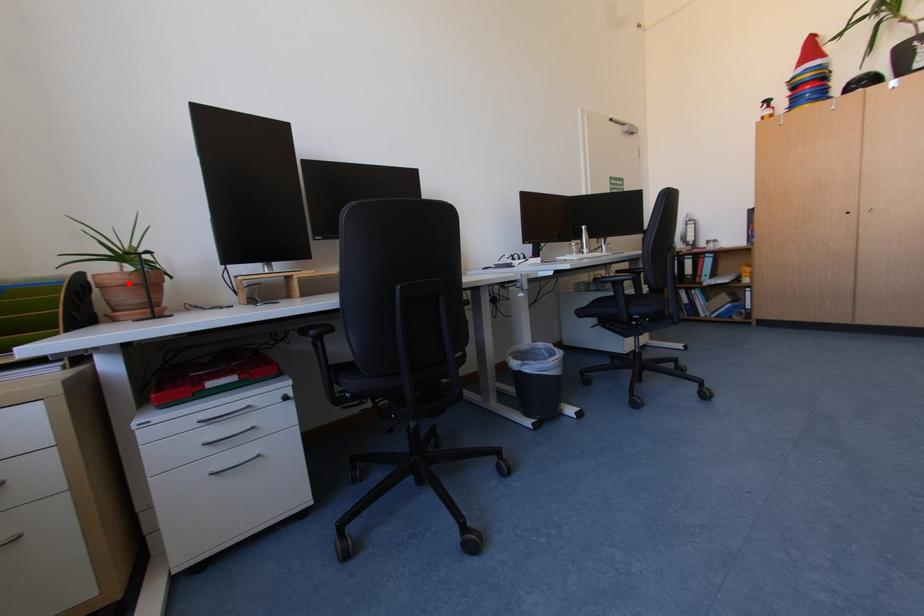
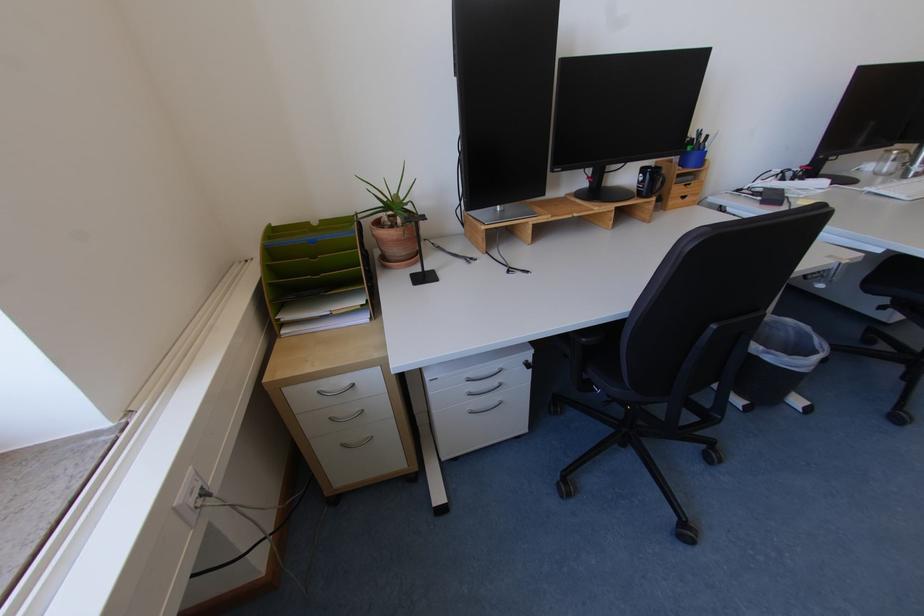
The point at the highlighted location is marked in the first image. Where is the corresponding point in the second image?

(403, 238)